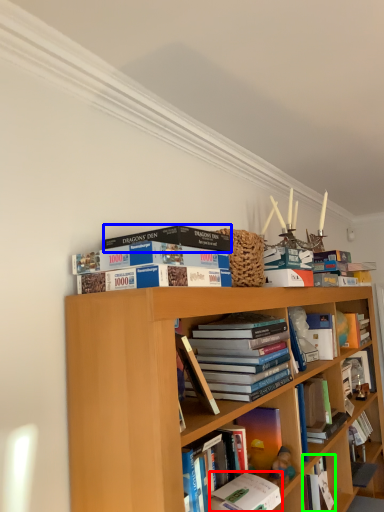
Question: Which object is positioned farthest from book (highlighted by a red box)? Select from book (highlighted by a blue box) and book (highlighted by a green box).

Choices:
 (A) book
 (B) book

Answer: (A)